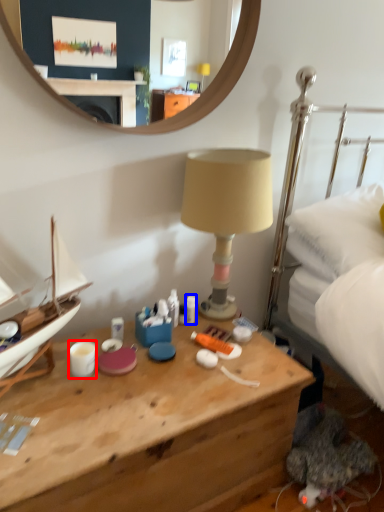
Question: Which object appears farthest to the camera in this image, coffee cup (highlighted by a red box) or toiletry (highlighted by a blue box)?

Choices:
 (A) coffee cup
 (B) toiletry

Answer: (B)